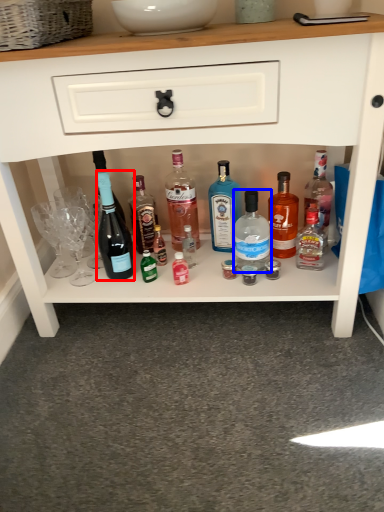
Question: Which object appears farthest to the camera in this image, bottle (highlighted by a red box) or bottle (highlighted by a blue box)?

Choices:
 (A) bottle
 (B) bottle

Answer: (B)